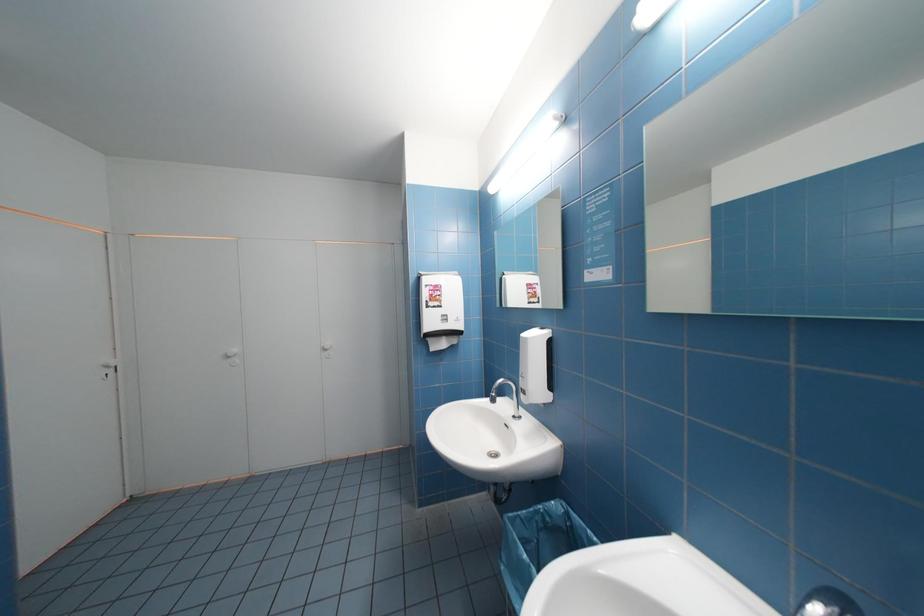
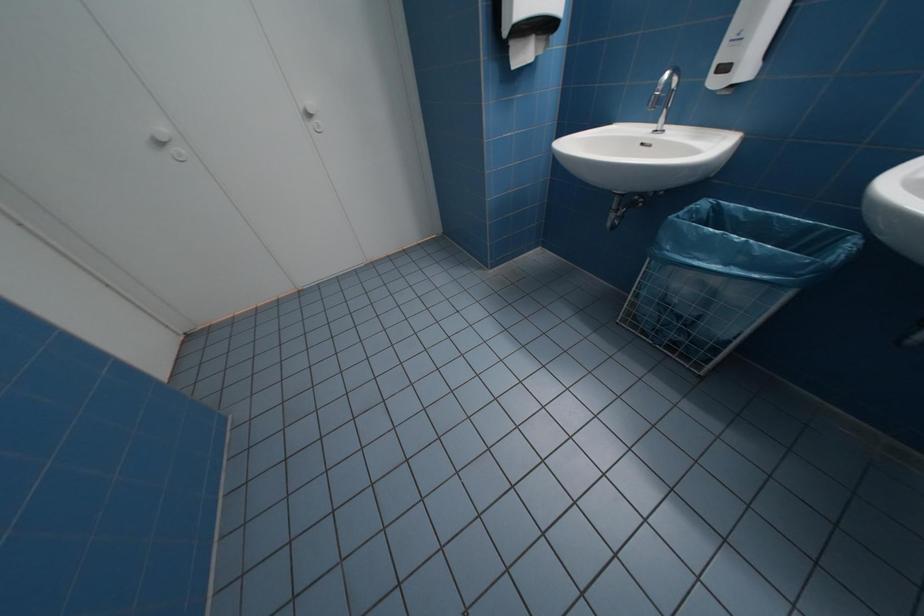
Question: How did the camera likely rotate?

Choices:
 (A) Left
 (B) Right
 (C) Up
 (D) Down

Answer: (D)